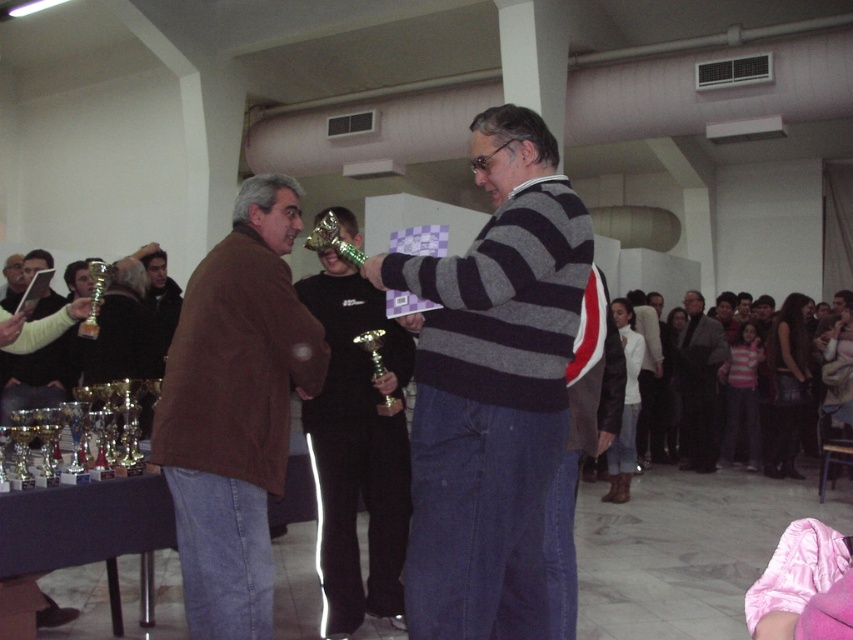
Question: Which object is farther from the camera taking this photo?

Choices:
 (A) striped sweater at center
 (B) dark gray wool sweater at center
 (C) brown leather jacket at left

Answer: (B)

Question: Does brown leather jacket at left have a lesser width compared to dark gray wool sweater at center?

Choices:
 (A) yes
 (B) no

Answer: (B)

Question: Which is nearer to the dark gray wool sweater at center?

Choices:
 (A) striped sweater at center
 (B) brown leather jacket at left

Answer: (B)

Question: Does striped sweater at center appear over dark gray wool sweater at center?

Choices:
 (A) yes
 (B) no

Answer: (A)

Question: Can you confirm if brown leather jacket at left is positioned above dark gray wool sweater at center?

Choices:
 (A) yes
 (B) no

Answer: (A)

Question: Among these points, which one is nearest to the camera?

Choices:
 (A) [698, 346]
 (B) [552, 349]
 (C) [210, 353]

Answer: (B)